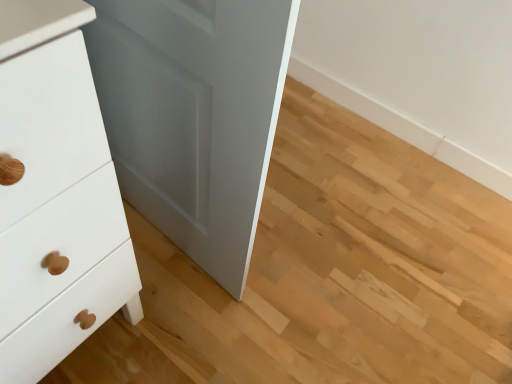
In order to face white matte wood chest of drawers at left, should I rotate leftwards or rightwards?

Rotate left and turn 30.851 degrees.

This screenshot has height=384, width=512. Describe the element at coordinates (58, 212) in the screenshot. I see `white matte wood chest of drawers at left` at that location.

Find the location of `white matte wood chest of drawers at left`. white matte wood chest of drawers at left is located at coordinates (58, 212).

Locate an element on the screen. This screenshot has height=384, width=512. white matte wood chest of drawers at left is located at coordinates (58, 212).